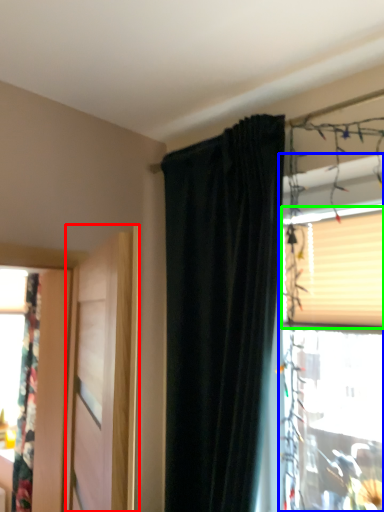
Question: Which is nearer to the door (highlighted by a red box)? window (highlighted by a blue box) or blind (highlighted by a green box).

Choices:
 (A) window
 (B) blind

Answer: (A)